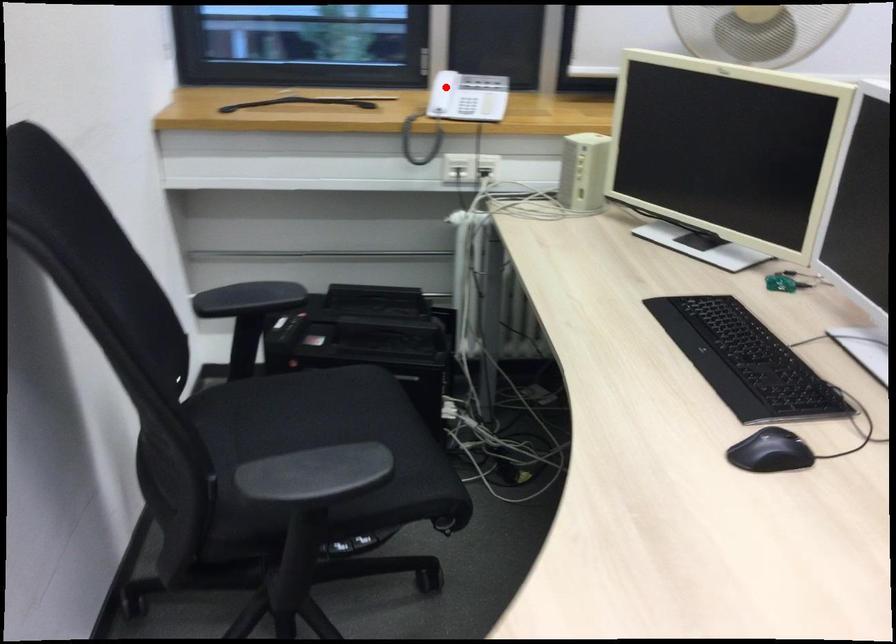
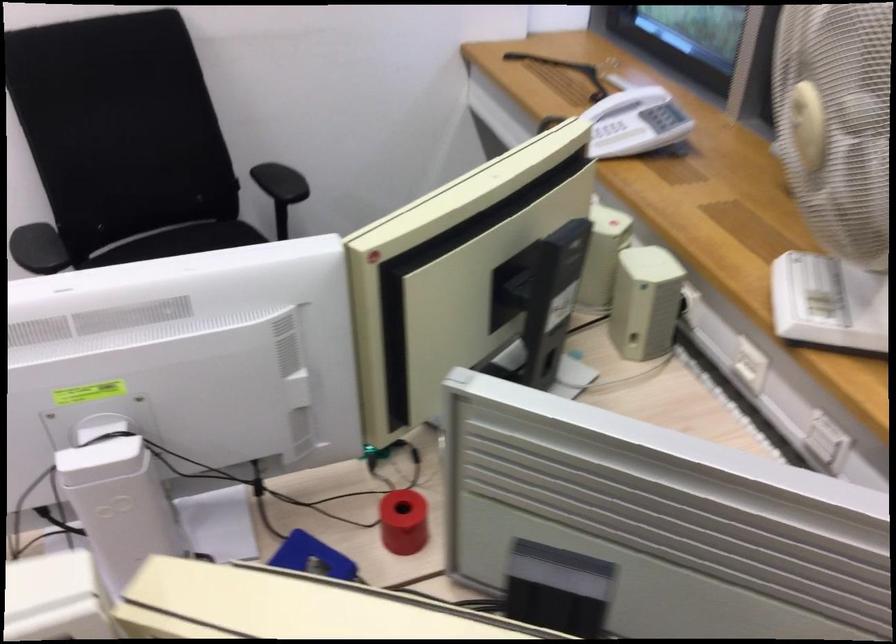
Find the pixel in the second image that matches the highlighted location in the first image.

(634, 122)